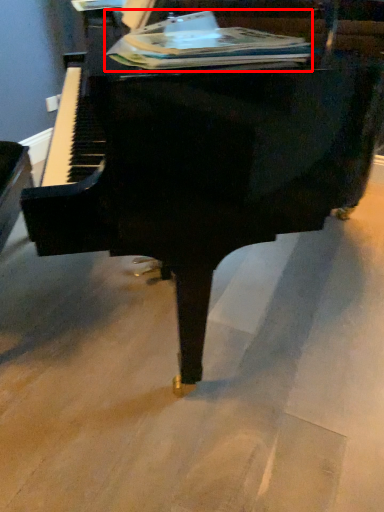
Question: From the image's perspective, where is paperback book (annotated by the red box) located in relation to piano in the image?

Choices:
 (A) above
 (B) below

Answer: (A)